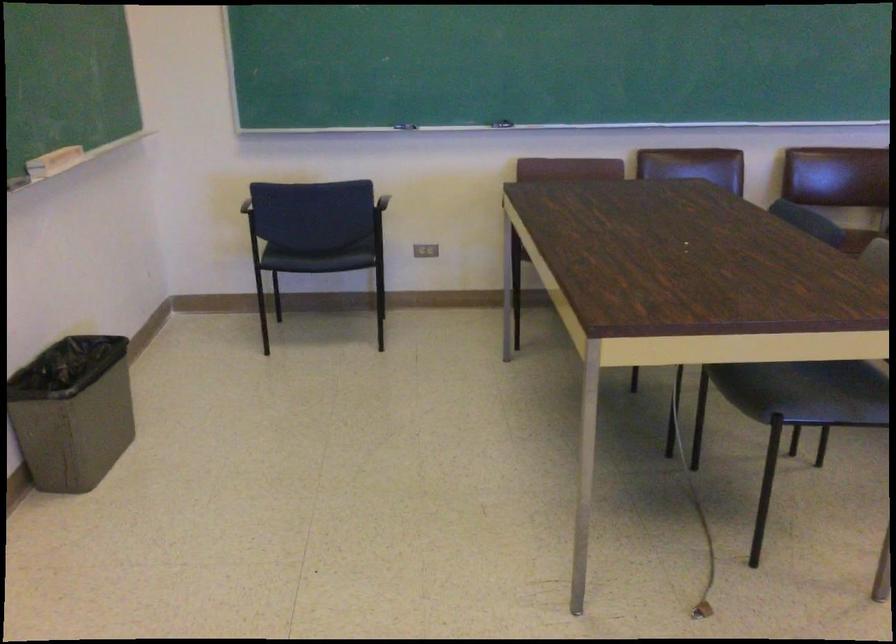
Where is `black chair sitting surface`? The height and width of the screenshot is (644, 896). black chair sitting surface is located at coordinates (765, 391).